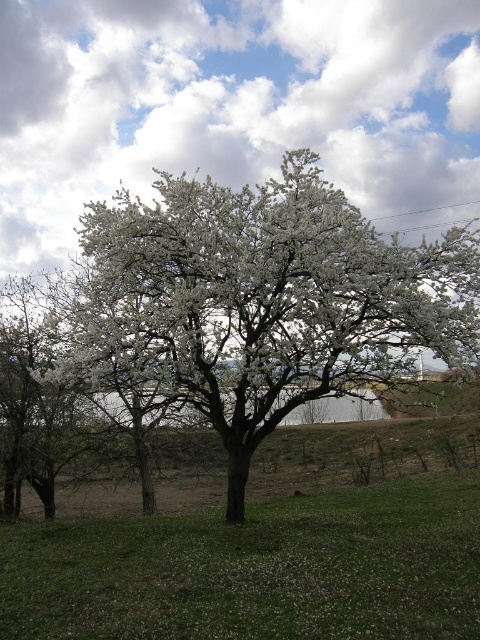
Is white blossoming tree at center shorter than green grassy at lower left?

Indeed, white blossoming tree at center has a lesser height compared to green grassy at lower left.

The image size is (480, 640). I want to click on white blossoming tree at center, so click(276, 298).

I want to click on white blossoming tree at center, so click(276, 298).